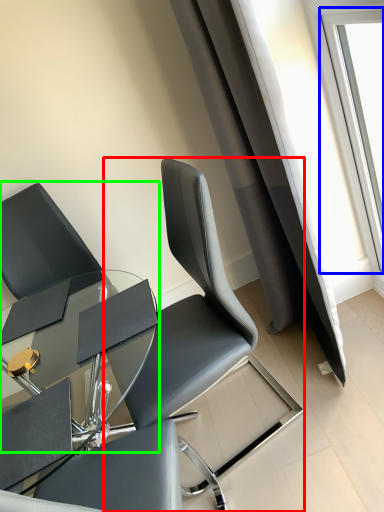
Question: Based on their relative distances, which object is farther from chair (highlighted by a red box)? Choose from window (highlighted by a blue box) and chair (highlighted by a green box).

Choices:
 (A) window
 (B) chair

Answer: (A)